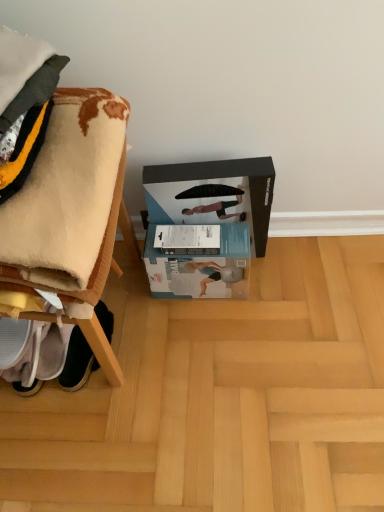
The width and height of the screenshot is (384, 512). Identify the location of vacant position to the left of black matte cardboard box at center. (128, 280).